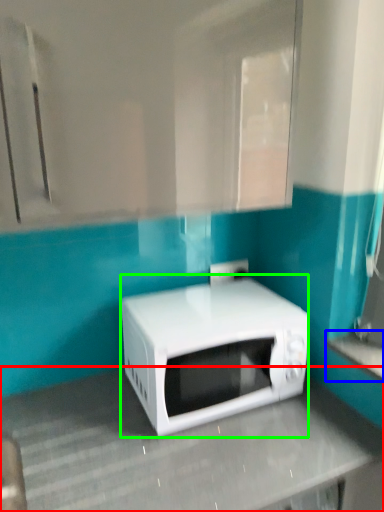
Question: Which object is the closest to the counter top (highlighted by a red box)? Choose among these: counter top (highlighted by a blue box) or microwave oven (highlighted by a green box).

Choices:
 (A) counter top
 (B) microwave oven

Answer: (B)